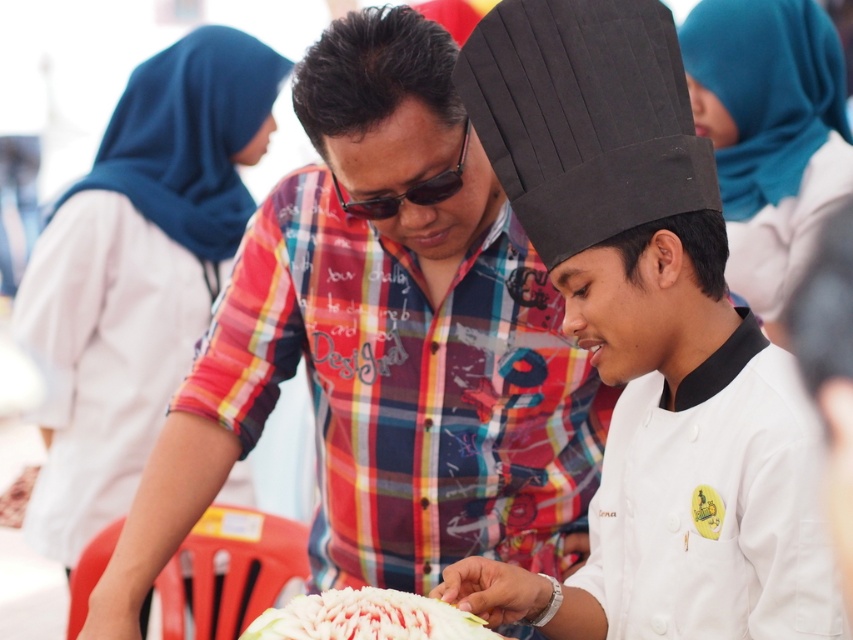
Does white chef hat at center appear over white fluffy cake at center?

Yes.

Does white chef hat at center have a greater width compared to white fluffy cake at center?

Indeed, white chef hat at center has a greater width compared to white fluffy cake at center.

Locate an element on the screen. Image resolution: width=853 pixels, height=640 pixels. white chef hat at center is located at coordinates (647, 340).

Locate an element on the screen. The height and width of the screenshot is (640, 853). white chef hat at center is located at coordinates (647, 340).

Is plaid shirt at center bigger than white fluffy cake at center?

Correct, plaid shirt at center is larger in size than white fluffy cake at center.

This screenshot has height=640, width=853. Describe the element at coordinates (384, 346) in the screenshot. I see `plaid shirt at center` at that location.

The image size is (853, 640). What are the coordinates of `plaid shirt at center` in the screenshot? It's located at (384, 346).

Describe the element at coordinates (384, 346) in the screenshot. The image size is (853, 640). I see `plaid shirt at center` at that location.

Which is more to the left, plaid shirt at center or white chef hat at center?

plaid shirt at center is more to the left.

Is point (305, 131) behind point (653, 136)?

Yes, it is.

Identify the location of plaid shirt at center. (384, 346).